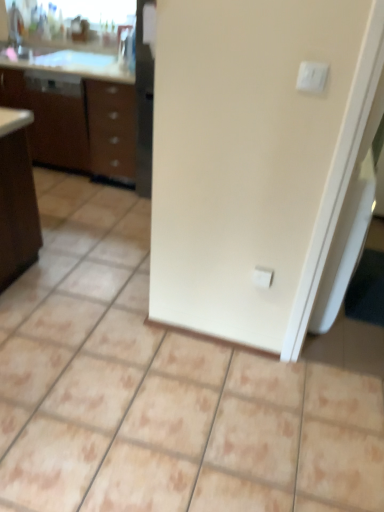
Question: In terms of width, does white glossy sink at upper left look wider or thinner when compared to white plastic electric outlet at center?

Choices:
 (A) wide
 (B) thin

Answer: (A)

Question: Is point (34, 40) positioned closer to the camera than point (258, 283)?

Choices:
 (A) farther
 (B) closer

Answer: (A)

Question: Which object is positioned closest to the white plastic electric outlet at center?

Choices:
 (A) white plastic light switch at upper right
 (B) brown wood/file cabinet at left
 (C) white glossy sink at upper left

Answer: (A)

Question: Considering the real-world distances, which object is farthest from the brown wood/file cabinet at left?

Choices:
 (A) white plastic light switch at upper right
 (B) white glossy sink at upper left
 (C) white plastic electric outlet at center

Answer: (A)